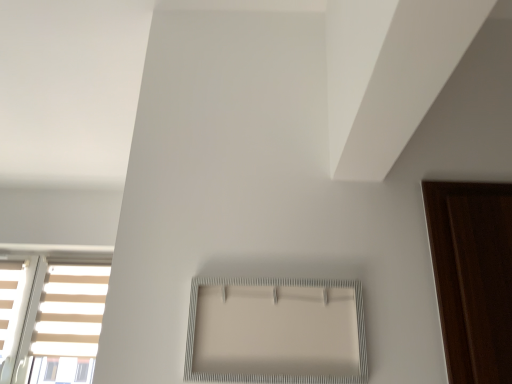
Question: Is white textured frame at center, which is the 1th window from top to bottom, positioned beyond the bounds of white matte blind at upper right?

Choices:
 (A) yes
 (B) no

Answer: (A)

Question: From a real-world perspective, is white textured frame at center, which is the 1th window from top to bottom, on white matte blind at upper right?

Choices:
 (A) no
 (B) yes

Answer: (A)

Question: Is white textured frame at center, which is the 1th window from top to bottom, next to white matte blind at upper right and touching it?

Choices:
 (A) no
 (B) yes

Answer: (A)

Question: Does white textured frame at center, the first window when ordered from front to back, have a lesser width compared to white matte blind at upper right?

Choices:
 (A) no
 (B) yes

Answer: (B)

Question: From the image's perspective, would you say white textured frame at center, which ranks as the 2th window in left-to-right order, is positioned over white matte blind at upper right?

Choices:
 (A) no
 (B) yes

Answer: (A)

Question: Based on their sizes in the image, would you say white textured frame at center, which ranks as the first window in right-to-left order, is bigger or smaller than white striped window at lower left, placed as the 1th window when sorted from bottom to top?

Choices:
 (A) small
 (B) big

Answer: (A)

Question: Is point (279, 375) closer or farther from the camera than point (84, 382)?

Choices:
 (A) closer
 (B) farther

Answer: (A)

Question: From the image's perspective, is white textured frame at center, the first window when ordered from front to back, located above or below white striped window at lower left, which is the 2th window from right to left?

Choices:
 (A) above
 (B) below

Answer: (A)

Question: In the image, is white textured frame at center, which is counted as the second window, starting from the bottom, positioned in front of or behind white striped window at lower left, placed as the 1th window when sorted from bottom to top?

Choices:
 (A) front
 (B) behind

Answer: (A)

Question: Considering the relative positions of white striped window at lower left, which is the 2th window from right to left, and white matte blind at upper right in the image provided, is white striped window at lower left, which is the 2th window from right to left, to the left or to the right of white matte blind at upper right?

Choices:
 (A) right
 (B) left

Answer: (B)

Question: In the image, is white striped window at lower left, placed as the 1th window when sorted from bottom to top, positioned in front of or behind white matte blind at upper right?

Choices:
 (A) front
 (B) behind

Answer: (B)

Question: Looking at the image, does white striped window at lower left, the 2th window viewed from the front, seem bigger or smaller compared to white matte blind at upper right?

Choices:
 (A) small
 (B) big

Answer: (B)

Question: Considering the positions of point (53, 296) and point (374, 59), is point (53, 296) closer or farther from the camera than point (374, 59)?

Choices:
 (A) farther
 (B) closer

Answer: (A)

Question: From the image's perspective, relative to white textured frame at center, the 2th window from the back, is white matte blind at upper right above or below?

Choices:
 (A) below
 (B) above

Answer: (B)

Question: Considering the positions of white matte blind at upper right and white textured frame at center, which is counted as the second window, starting from the bottom, in the image, is white matte blind at upper right taller or shorter than white textured frame at center, which is counted as the second window, starting from the bottom,?

Choices:
 (A) short
 (B) tall

Answer: (A)